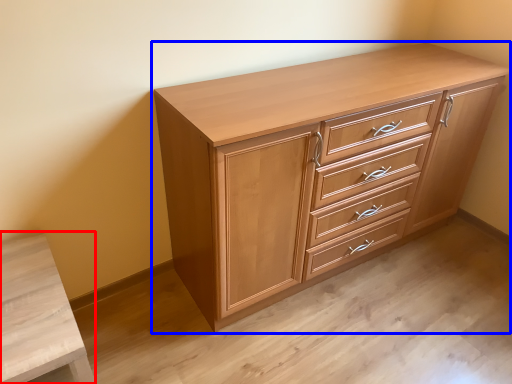
Question: Which object appears closest to the camera in this image, vanity (highlighted by a red box) or chest of drawers (highlighted by a blue box)?

Choices:
 (A) vanity
 (B) chest of drawers

Answer: (A)